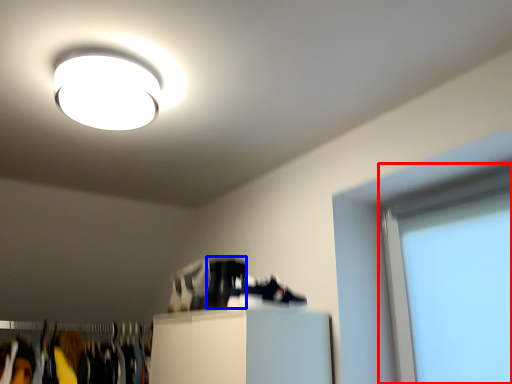
Question: Which of the following is the farthest to the observer, window screen (highlighted by a red box) or shoe (highlighted by a blue box)?

Choices:
 (A) window screen
 (B) shoe

Answer: (B)